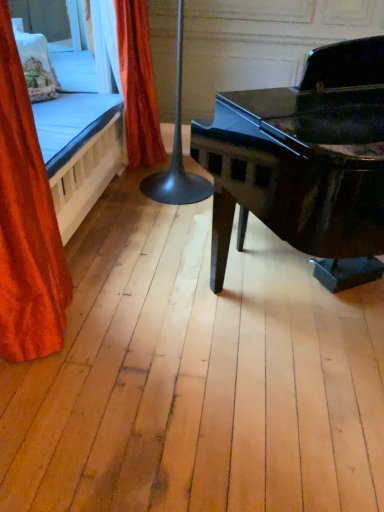
I want to click on free spot in front of orange velvet curtain at upper left, the first curtain in the back-to-front sequence, so click(136, 201).